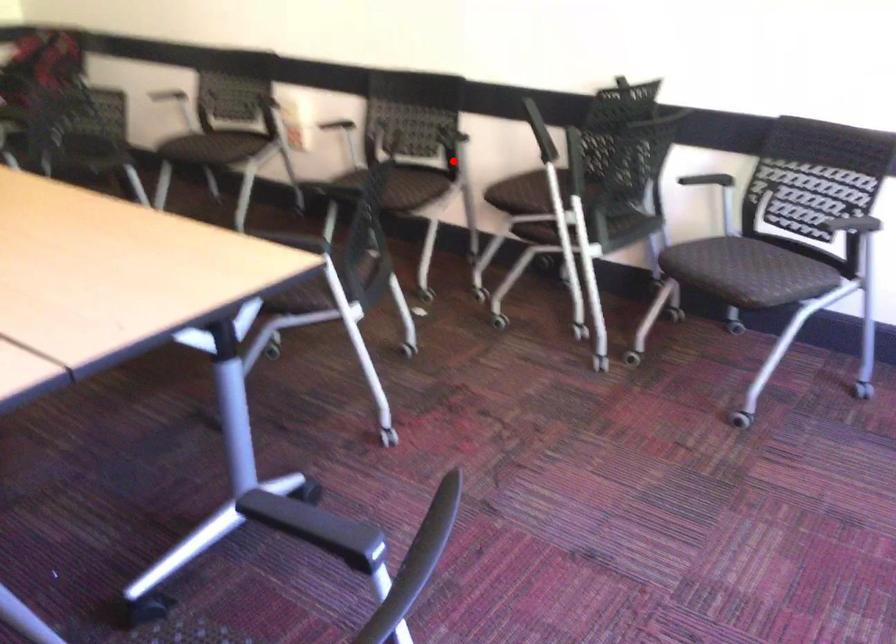
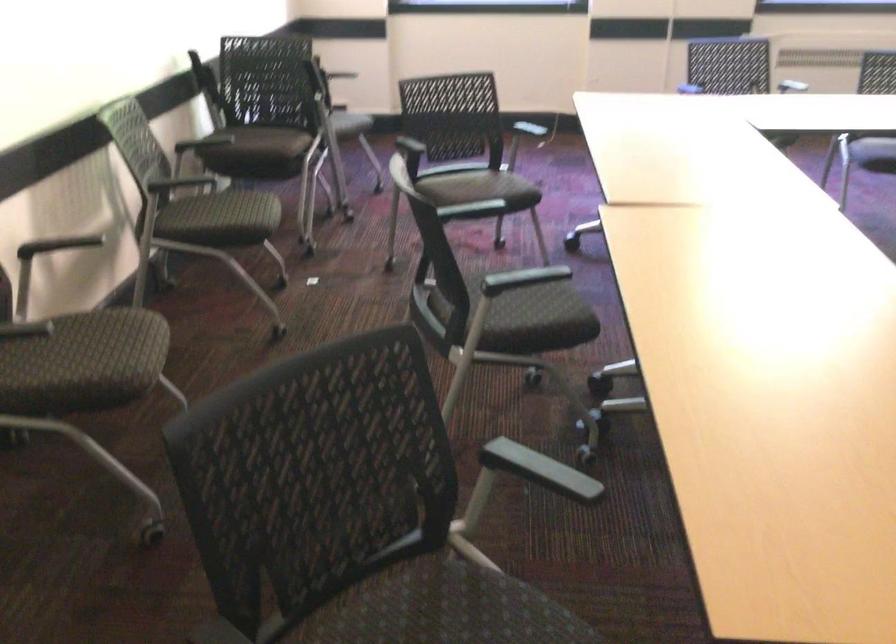
Question: I am providing you with two images of the same scene from different viewpoints. Given a red point in image1, look at the same physical point in image2. Is it:

Choices:
 (A) Closer to the viewpoint
 (B) Farther from the viewpoint

Answer: (A)